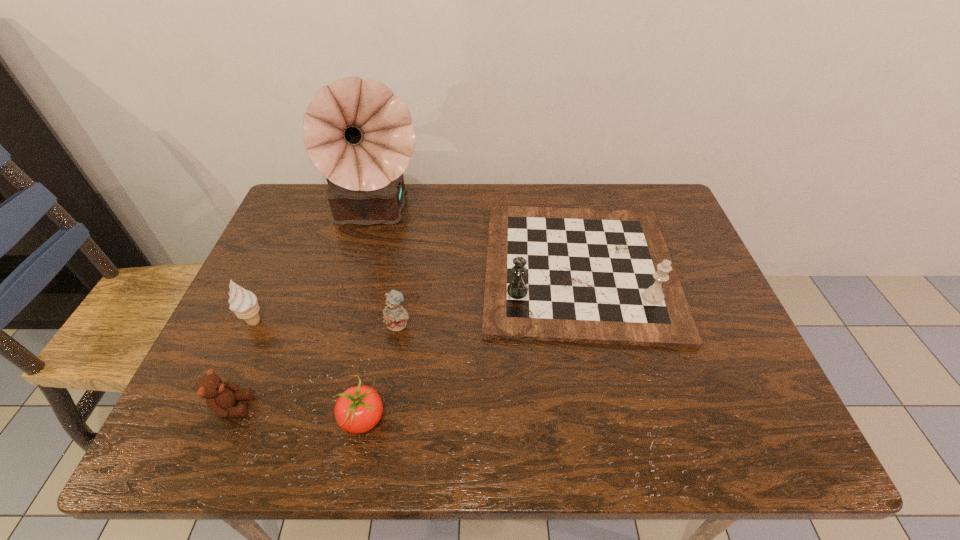
Where is `object that is at the far left corner`? The height and width of the screenshot is (540, 960). object that is at the far left corner is located at coordinates (358, 134).

At what (x,y) coordinates should I click in order to perform the action: click on object that is at the near left corner. Please return your answer as a coordinate pair (x, y). The image size is (960, 540). Looking at the image, I should click on (220, 396).

The width and height of the screenshot is (960, 540). I want to click on object situated at the far right corner, so click(x=580, y=275).

At what (x,y) coordinates should I click in order to perform the action: click on blank space at the far edge of the desktop. Please return your answer as a coordinate pair (x, y). This screenshot has width=960, height=540. Looking at the image, I should click on (522, 193).

In the image, there is a desktop. Find the location of `vacant space at the near edge`. vacant space at the near edge is located at coordinates (397, 431).

The image size is (960, 540). What are the coordinates of `vacant space at the left edge` in the screenshot? It's located at (265, 325).

Identify the location of vacant area at the right edge of the desktop. (673, 359).

In the image, there is a desktop. Where is `vacant area at the near right corner`? The image size is (960, 540). vacant area at the near right corner is located at coordinates tap(774, 424).

Locate an element on the screen. This screenshot has height=540, width=960. free spot between the record player and the gameboard is located at coordinates (476, 242).

At what (x,y) coordinates should I click in order to perform the action: click on free space between the right teddy bear and the icecream. Please return your answer as a coordinate pair (x, y). Looking at the image, I should click on (326, 323).